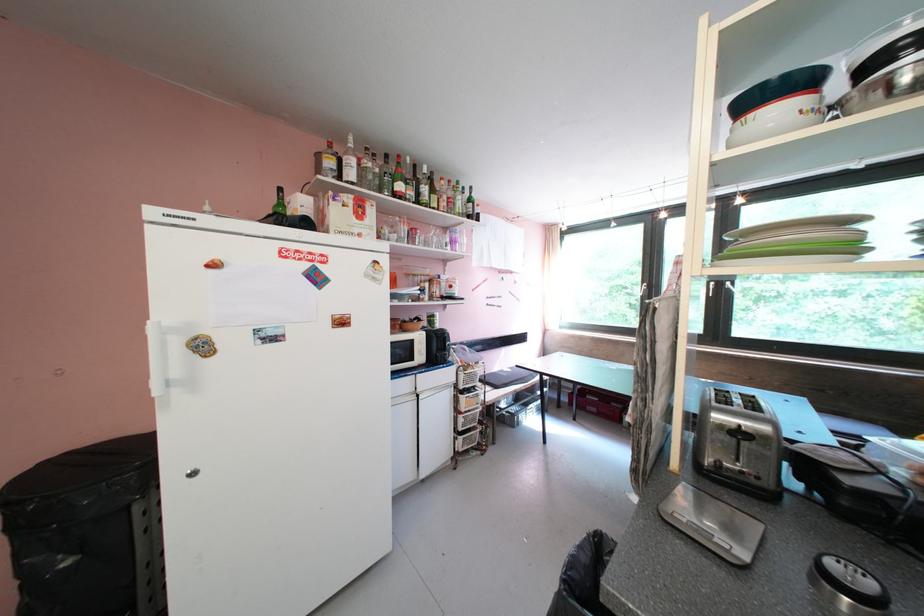
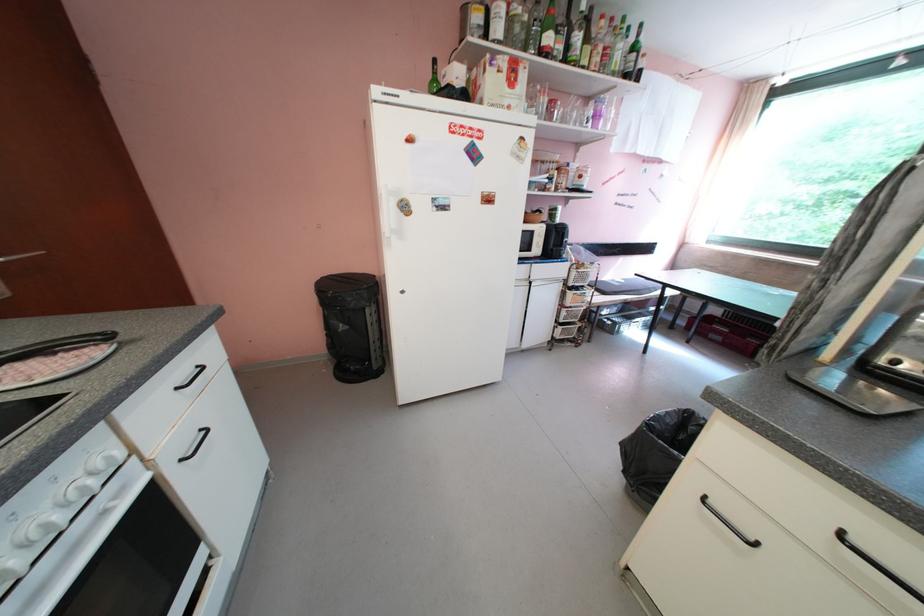
Locate, in the second image, the point that corresponds to point 468,392 in the first image.

(576, 290)